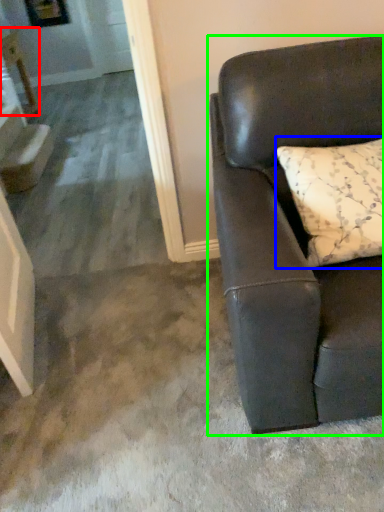
Question: Considering the real-world distances, which object is closest to table (highlighted by a red box)? pillow (highlighted by a blue box) or studio couch (highlighted by a green box).

Choices:
 (A) pillow
 (B) studio couch

Answer: (B)